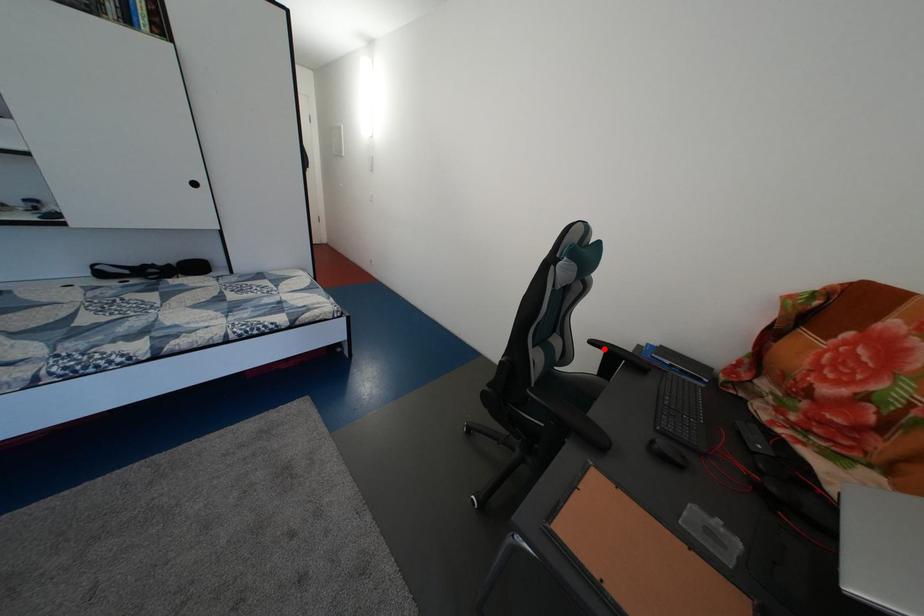
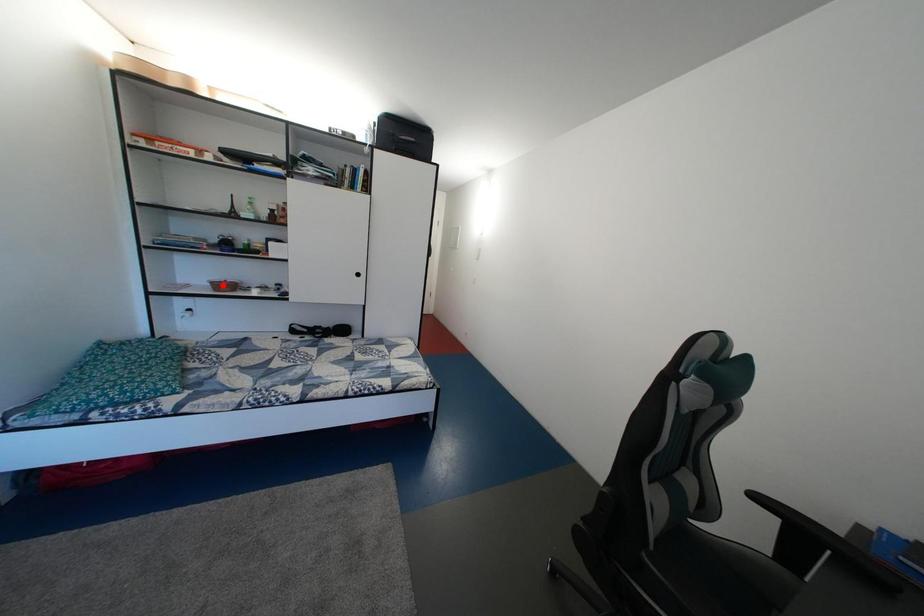
I am providing you with two images of the same scene from different viewpoints. A red point is marked on the first image and another point is marked on the second image. Does the point marked in image1 correspond to the same location as the one in image2?

No